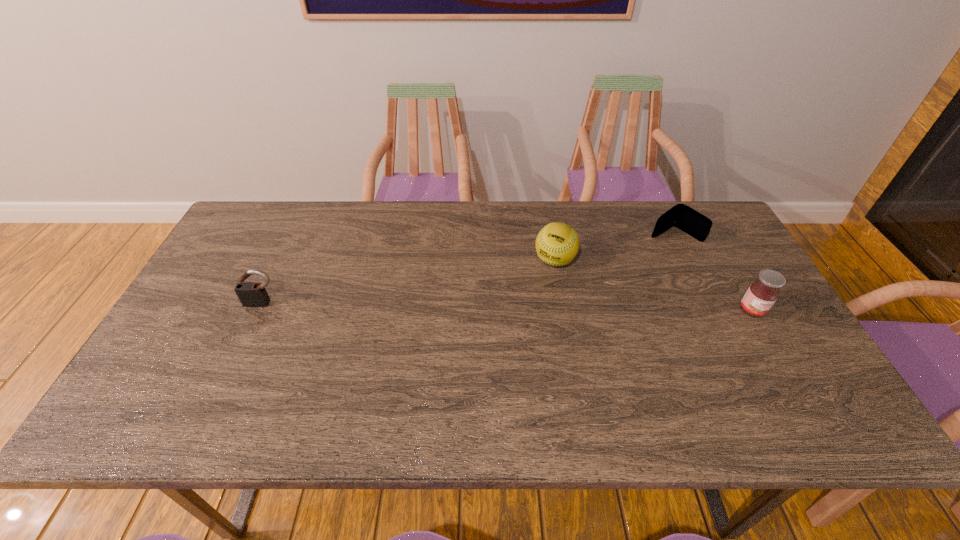
This screenshot has width=960, height=540. Identify the location of padlock. (x=251, y=294).

The width and height of the screenshot is (960, 540). Find the location of `jam`. jam is located at coordinates (761, 295).

The height and width of the screenshot is (540, 960). Find the location of `the second farthest object`. the second farthest object is located at coordinates (557, 244).

You are a GUI agent. You are given a task and a screenshot of the screen. Output one action in this format:
    pyautogui.click(x=<x>, y=<y>)
    Task: Click on the second object from left to right
    Image resolution: width=960 pixels, height=540 pixels.
    Given the screenshot: What is the action you would take?
    pyautogui.click(x=557, y=244)

This screenshot has height=540, width=960. What are the coordinates of `the shortest object` in the screenshot? It's located at (681, 216).

This screenshot has height=540, width=960. I want to click on the farthest object, so click(x=681, y=216).

This screenshot has height=540, width=960. I want to click on free region located 0.090m with the keyhole on the front of the leftmost object, so coord(249,334).

This screenshot has height=540, width=960. I want to click on vacant space located on the label side of the jam, so [x=772, y=346].

Locate an element on the screen. vacant space located on the logo side of the third object from right to left is located at coordinates (522, 316).

Where is `free space located on the logo side of the third object from right to left`? free space located on the logo side of the third object from right to left is located at coordinates (497, 357).